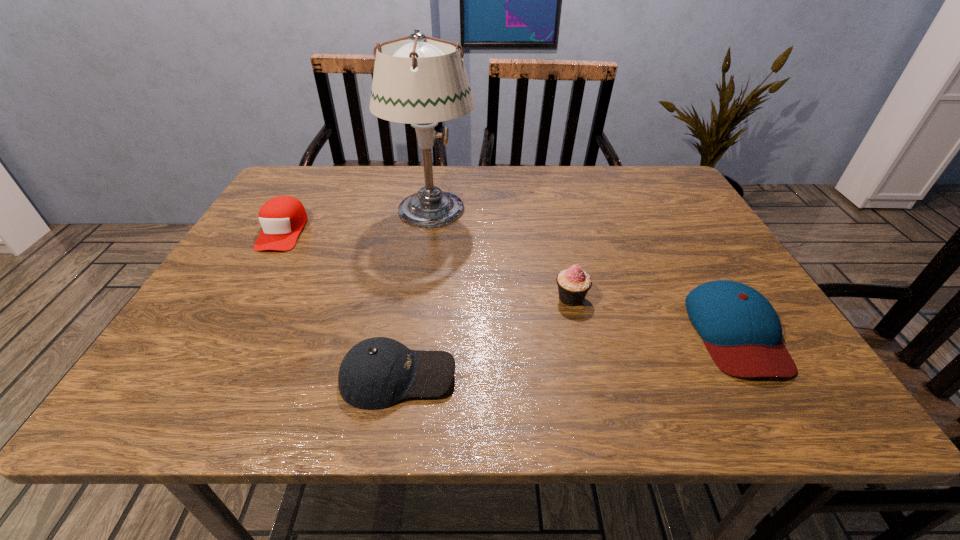
The height and width of the screenshot is (540, 960). In order to click on vacant space at the near right corner of the desktop in this screenshot , I will do `click(828, 413)`.

You are a GUI agent. You are given a task and a screenshot of the screen. Output one action in this format:
    pyautogui.click(x=<x>, y=<y>)
    Task: Click on the unoccupied position between the rightmost baseball cap and the cupcake
    This screenshot has width=960, height=540.
    Given the screenshot: What is the action you would take?
    pyautogui.click(x=654, y=315)

Where is `free space between the rightmost object and the fourth object from left to right`? free space between the rightmost object and the fourth object from left to right is located at coordinates (x=654, y=315).

Where is `free space between the rightmost baseball cap and the second baseball cap from right to left`? This screenshot has height=540, width=960. free space between the rightmost baseball cap and the second baseball cap from right to left is located at coordinates (567, 354).

You are a GUI agent. You are given a task and a screenshot of the screen. Output one action in this format:
    pyautogui.click(x=<x>, y=<y>)
    Task: Click on the unoccupied position between the second object from right to left and the second baseball cap from left to right
    The height and width of the screenshot is (540, 960).
    Given the screenshot: What is the action you would take?
    pyautogui.click(x=485, y=337)

I want to click on free spot between the farthest baseball cap and the tallest object, so click(357, 220).

Where is `free space between the fourth object from left to right and the second baseball cap from left to right`? free space between the fourth object from left to right and the second baseball cap from left to right is located at coordinates (485, 337).

You are a GUI agent. You are given a task and a screenshot of the screen. Output one action in this format:
    pyautogui.click(x=<x>, y=<y>)
    Task: Click on the vacant space in between the rightmost object and the second baseball cap from right to left
    The image size is (960, 540).
    Given the screenshot: What is the action you would take?
    pyautogui.click(x=567, y=354)

Find the location of a particular element. free spot between the farthest baseball cap and the lampshade is located at coordinates (357, 220).

You are a GUI agent. You are given a task and a screenshot of the screen. Output one action in this format:
    pyautogui.click(x=<x>, y=<y>)
    Task: Click on the object that is the closest to the rightmost baseball cap
    The image size is (960, 540).
    Given the screenshot: What is the action you would take?
    pyautogui.click(x=573, y=284)